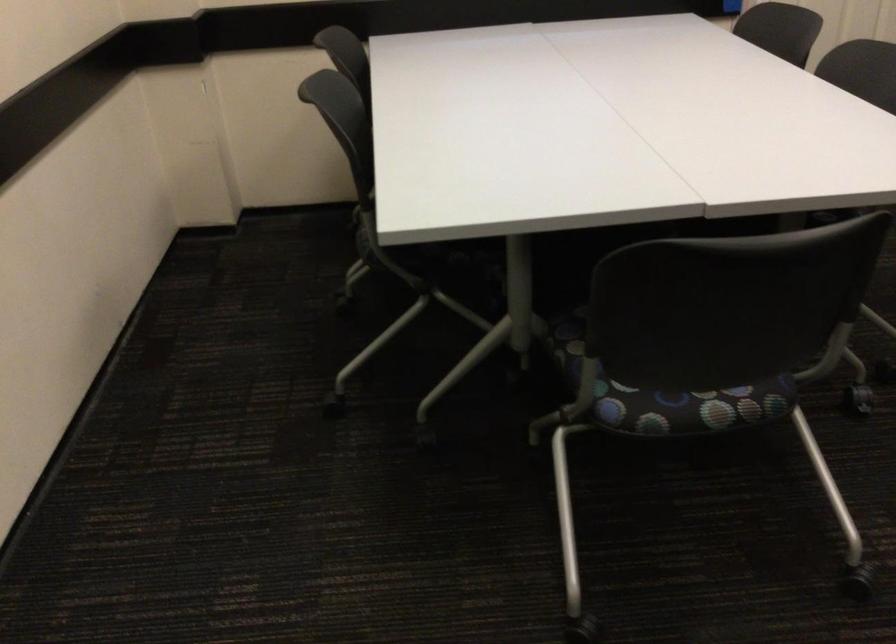
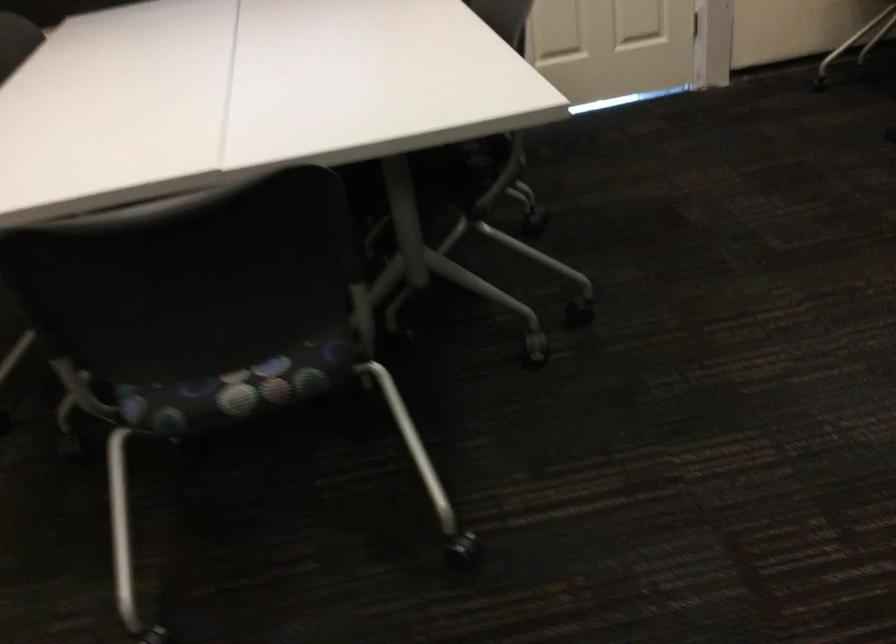
Question: The camera is either moving clockwise (left) or counter-clockwise (right) around the object. The first image is from the beginning of the video and the second image is from the end. Is the camera moving left or right when shooting the video?

Choices:
 (A) Left
 (B) Right

Answer: (A)